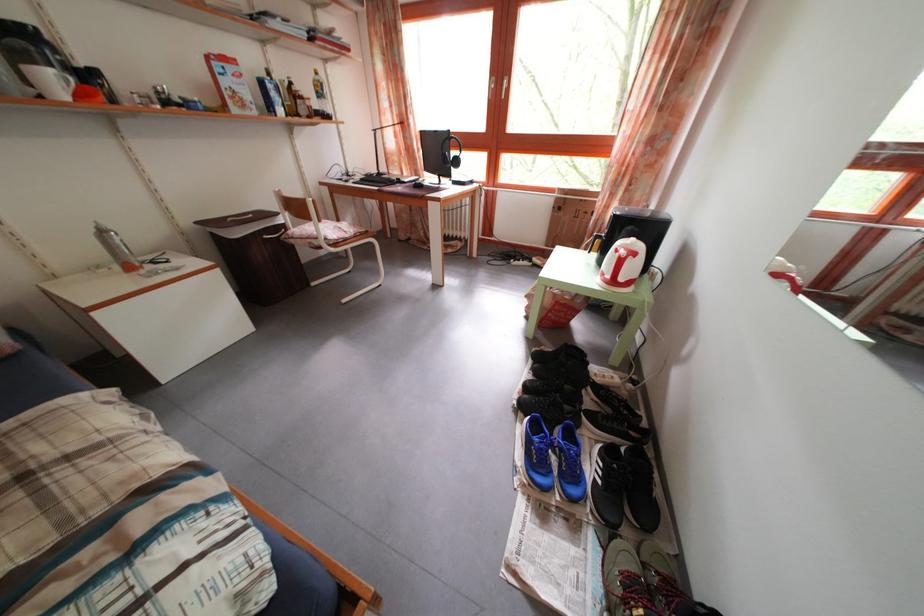
Where would you lift the black headphones? Please return your answer as a coordinate pair (x, y).

(450, 151)